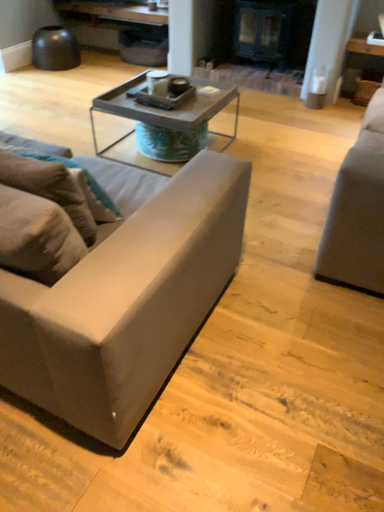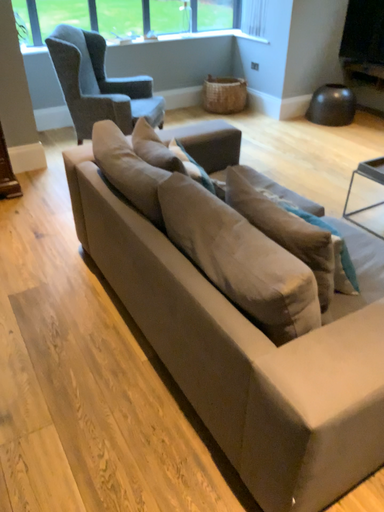
Question: Which way did the camera rotate in the video?

Choices:
 (A) rotated right
 (B) rotated left

Answer: (B)